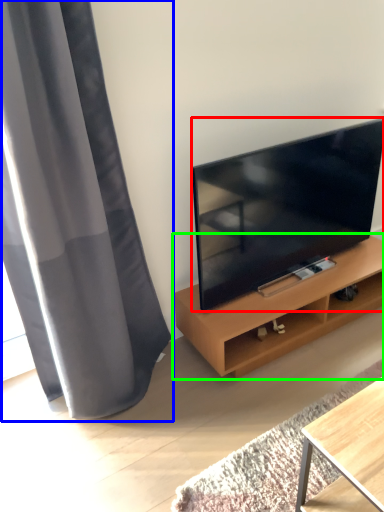
Question: Which object is positioned closest to television (highlighted by a red box)? Select from curtain (highlighted by a blue box) and shelf (highlighted by a green box).

Choices:
 (A) curtain
 (B) shelf

Answer: (B)